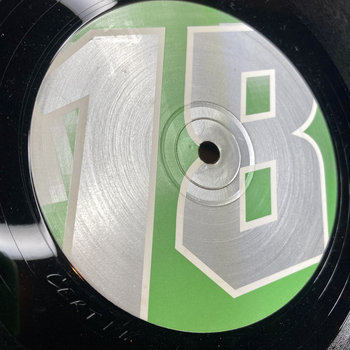
This screenshot has height=350, width=350. I want to click on green paint, so click(x=174, y=285), click(x=59, y=213), click(x=146, y=9), click(x=257, y=92), click(x=264, y=188), click(x=317, y=135), click(x=169, y=83).